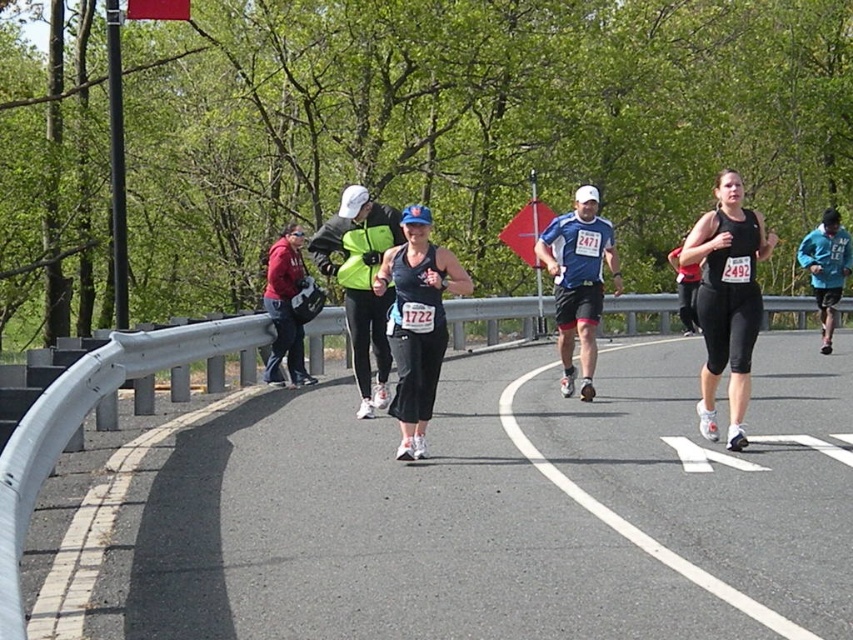
In the scene shown: Is matte black tank top at center wider than matte red jacket at left?

Indeed, matte black tank top at center has a greater width compared to matte red jacket at left.

Which of these two, matte black tank top at center or matte red jacket at left, stands shorter?

matte red jacket at left

Between point (425, 349) and point (302, 240), which one is positioned in front?

Point (425, 349) is in front.

I want to click on matte black tank top at center, so click(x=416, y=323).

Which of these two, black matte running outfit at center or matte black tank top at center, stands shorter?

black matte running outfit at center

Consider the image. Who is taller, black matte running outfit at center or matte black tank top at center?

With more height is matte black tank top at center.

Is point (722, 243) positioned before point (425, 342)?

That is False.

Identify the location of black matte running outfit at center. (727, 300).

Does black matte running outfit at center appear on the right side of blue fabric shirt at center?

Yes, black matte running outfit at center is to the right of blue fabric shirt at center.

Is black matte running outfit at center above blue fabric shirt at center?

Indeed, black matte running outfit at center is positioned over blue fabric shirt at center.

Which is behind, point (698, 321) or point (579, 397)?

Point (579, 397)

This screenshot has height=640, width=853. I want to click on black matte running outfit at center, so pyautogui.click(x=727, y=300).